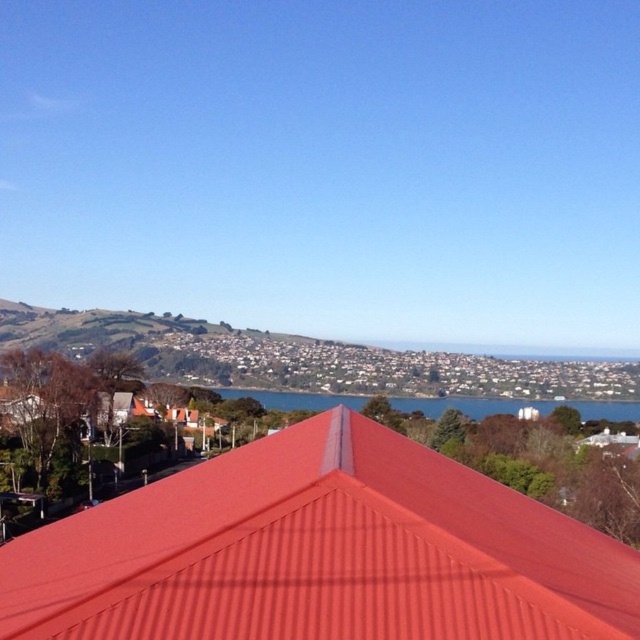
In the scene shown: You are standing on the rooftop and want to take a photo of the blue water at center. The metallic red roof at center is blocking your view. Can you move to the left or right to avoid the roof?

The metallic red roof at center is closer to the viewer than the blue water at center, so moving to the left or right might allow you to see around the roof and capture the blue water at center in your photo.

You are standing on the roof of a building and looking out. You see a metallic red roof at center and blue water at center. Which object is higher in the scene?

The metallic red roof at center is above the blue water at center, so it is higher in the scene.